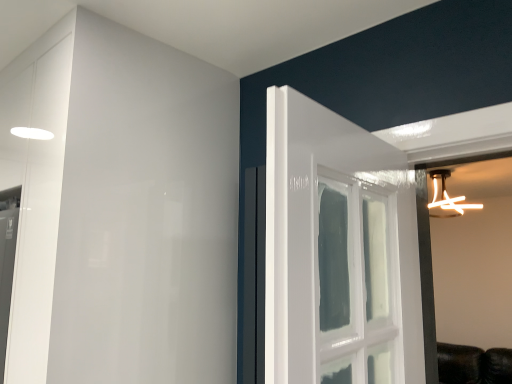
At what (x,y) coordinates should I click in order to perform the action: click on white glossy dresser at left. Please return your answer as a coordinate pair (x, y). Looking at the image, I should click on (121, 209).

The height and width of the screenshot is (384, 512). What do you see at coordinates (121, 209) in the screenshot? I see `white glossy dresser at left` at bounding box center [121, 209].

You are a GUI agent. You are given a task and a screenshot of the screen. Output one action in this format:
    pyautogui.click(x=<x>, y=<y>)
    Task: Click on the white glossy dresser at left
    
    Given the screenshot: What is the action you would take?
    pyautogui.click(x=121, y=209)